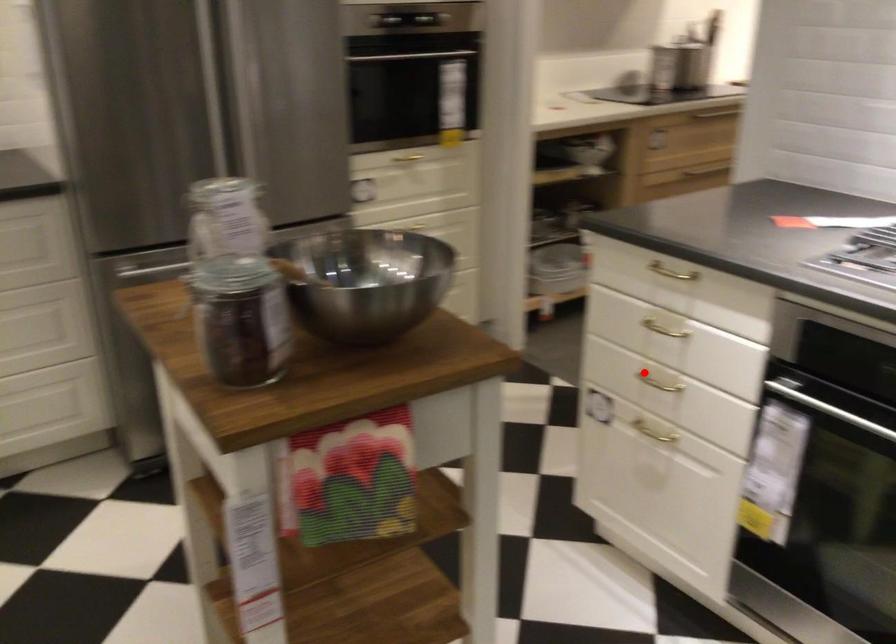
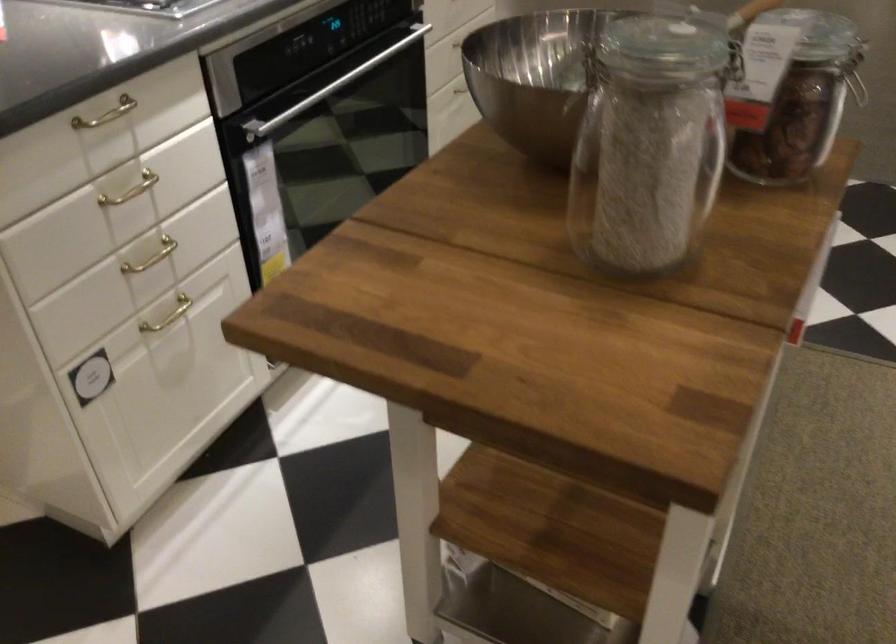
Question: I am providing you with two images of the same scene from different viewpoints. In image1, a red point is highlighted. Considering the same 3D point in image2, which of the following is correct?

Choices:
 (A) It is closer
 (B) It is farther

Answer: (A)